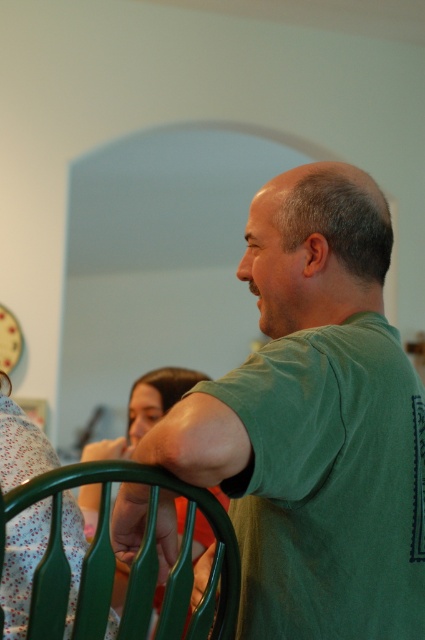
Question: Which object is closer to the camera taking this photo?

Choices:
 (A) matte green chair at lower left
 (B) green plastic chair at lower left
 (C) green matte hand at center
 (D) green matte shirt at center

Answer: (B)

Question: Is matte green chair at lower left closer to the viewer compared to green matte hand at center?

Choices:
 (A) yes
 (B) no

Answer: (A)

Question: Which point is farther from the camera taking this photo?

Choices:
 (A) (172, 531)
 (B) (251, 598)
 (C) (201, 518)

Answer: (C)

Question: Which point appears farthest from the camera in this image?

Choices:
 (A) [x=408, y=628]
 (B) [x=107, y=576]
 (C) [x=206, y=563]
 (D) [x=124, y=484]

Answer: (C)

Question: Is matte green chair at lower left wider than green matte hand at center?

Choices:
 (A) yes
 (B) no

Answer: (A)

Question: Observing the image, what is the correct spatial positioning of green matte shirt at center in reference to green plastic chair at lower left?

Choices:
 (A) left
 (B) right

Answer: (B)